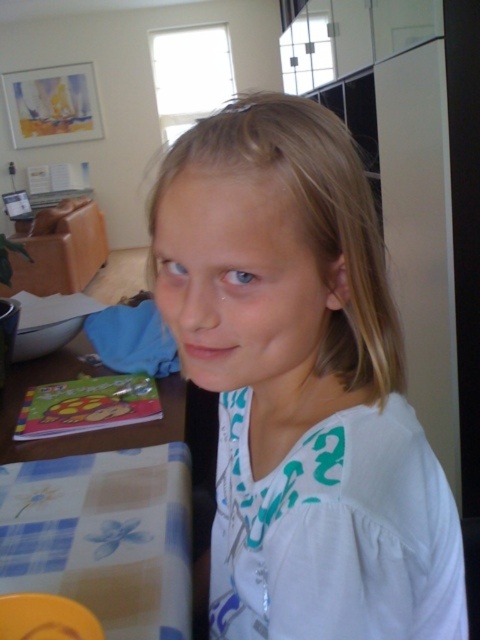
You are a fashion designer who wants to place a new dress on the white cotton shirt at center and the wooden table at lower left. Which object should you place it on if the dress is meant to be displayed on a surface that is to the right of the table?

A: The white cotton shirt at center should be used to display the dress because it is positioned to the right of the wooden table at lower left.

You are standing in the living room and want to place a decorative vase that is 18 inches tall on the plaid fabric tablecloth at lower left. Can the tablecloth support the vase?

The plaid fabric tablecloth at lower left is 22.23 inches away from the viewer, which does not indicate its size or capacity to hold the vase. The distance provided does not determine if the tablecloth can support the vase. Consider checking the tablecloth material and table stability instead.